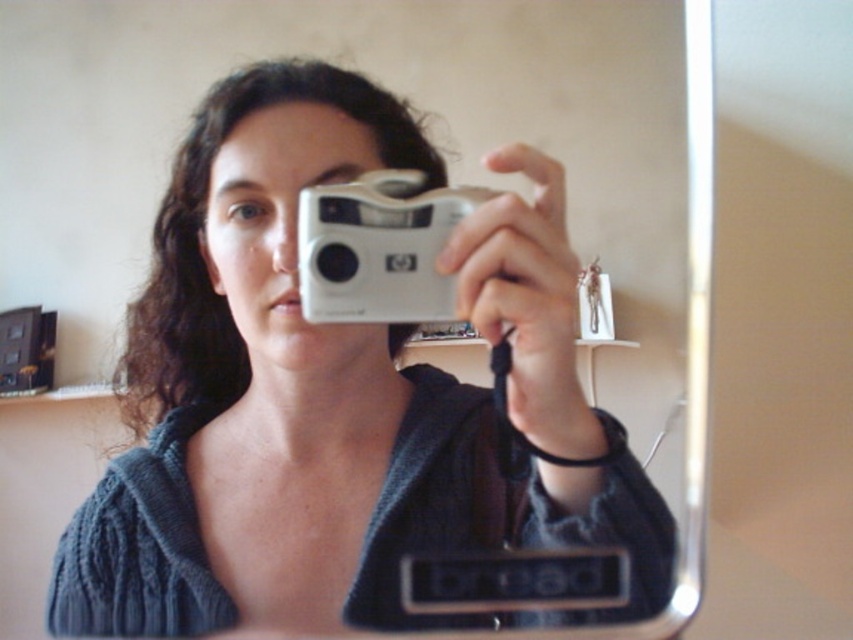
Question: Which object is the closest to the knitted dark blue sweater at center?

Choices:
 (A) silver metallic camera at center
 (B) matte silver camera at center

Answer: (B)

Question: Which object is the farthest from the matte silver camera at center?

Choices:
 (A) knitted dark blue sweater at center
 (B) silver metallic camera at center

Answer: (B)

Question: Does matte silver camera at center have a larger size compared to silver metallic camera at center?

Choices:
 (A) yes
 (B) no

Answer: (A)

Question: Among these objects, which one is farthest from the camera?

Choices:
 (A) matte silver camera at center
 (B) silver metallic camera at center
 (C) knitted dark blue sweater at center

Answer: (C)

Question: Is knitted dark blue sweater at center behind silver metallic camera at center?

Choices:
 (A) no
 (B) yes

Answer: (B)

Question: Can you confirm if matte silver camera at center is bigger than silver metallic camera at center?

Choices:
 (A) no
 (B) yes

Answer: (B)